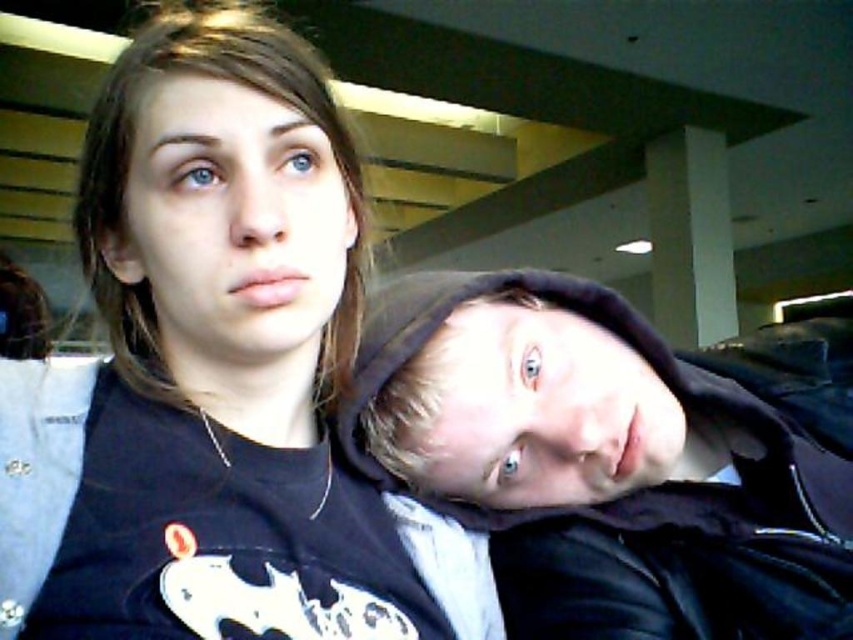
Question: Which of the following is the farthest from the observer?

Choices:
 (A) (164, 211)
 (B) (467, 332)

Answer: (B)

Question: From the image, what is the correct spatial relationship of black hoodie at upper right in relation to black hoodie at center?

Choices:
 (A) right
 (B) left

Answer: (B)

Question: Does black hoodie at upper right lie behind black hoodie at center?

Choices:
 (A) no
 (B) yes

Answer: (A)

Question: Can you confirm if black hoodie at upper right is positioned to the left of black hoodie at center?

Choices:
 (A) no
 (B) yes

Answer: (B)